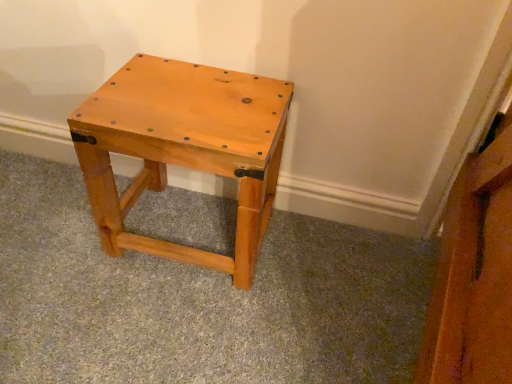
This screenshot has width=512, height=384. I want to click on natural wood stool at center, so click(x=184, y=148).

The width and height of the screenshot is (512, 384). Describe the element at coordinates (184, 148) in the screenshot. I see `natural wood stool at center` at that location.

Where is `natural wood stool at center`? This screenshot has width=512, height=384. natural wood stool at center is located at coordinates (184, 148).